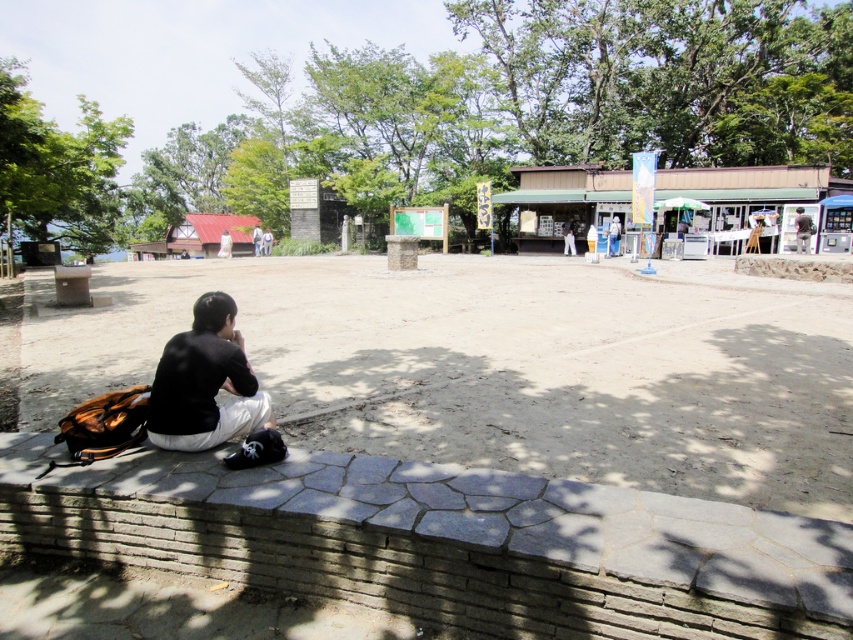
Question: Can you confirm if black matte shirt at lower left is positioned below black cotton shirt at center?

Choices:
 (A) no
 (B) yes

Answer: (B)

Question: Is brick at lower left wider than black matte shirt at lower left?

Choices:
 (A) no
 (B) yes

Answer: (B)

Question: Among these points, which one is farthest from the camera?

Choices:
 (A) (805, 227)
 (B) (436, 531)
 (C) (207, 307)

Answer: (A)

Question: Which object is closer to the camera taking this photo?

Choices:
 (A) black matte shirt at lower left
 (B) black cotton shirt at center
 (C) brick at lower left

Answer: (C)

Question: Which point is farther from the camera taking this photo?

Choices:
 (A) (215, 355)
 (B) (135, 460)

Answer: (A)

Question: In this image, where is brick at lower left located relative to black matte shirt at lower left?

Choices:
 (A) right
 (B) left

Answer: (A)